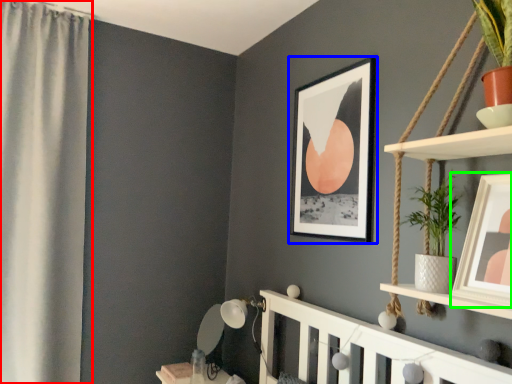
Question: Which is farther away from curtain (highlighted by a red box)? picture frame (highlighted by a blue box) or picture frame (highlighted by a green box)?

Choices:
 (A) picture frame
 (B) picture frame

Answer: (B)